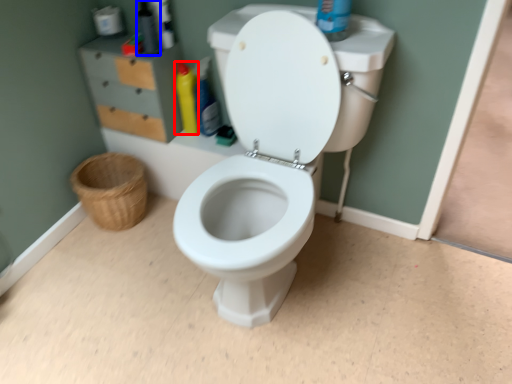
Question: Which of the following is the closest to the observer, cleaning product (highlighted by a red box) or toiletry (highlighted by a blue box)?

Choices:
 (A) cleaning product
 (B) toiletry

Answer: (B)